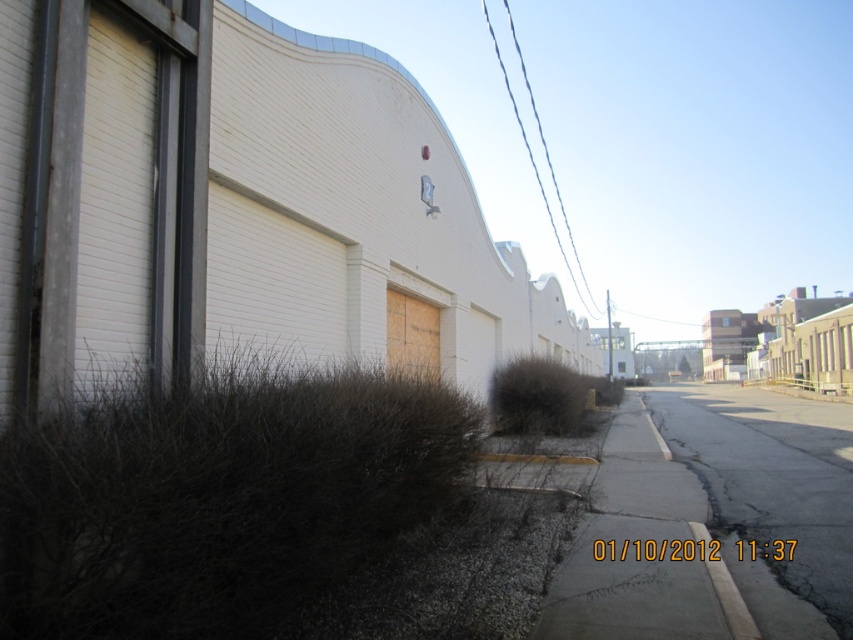
Between black asphalt road at center and gray concrete curb at lower right, which one appears on the left side from the viewer's perspective?

Positioned to the left is gray concrete curb at lower right.

Can you confirm if black asphalt road at center is positioned above gray concrete curb at lower right?

No.

Does point (737, 496) come behind point (715, 572)?

Yes, point (737, 496) is farther from viewer.

The height and width of the screenshot is (640, 853). I want to click on black asphalt road at center, so click(769, 486).

Can you confirm if gray asphalt pavement at center is positioned above gray concrete curb at lower right?

Incorrect, gray asphalt pavement at center is not positioned above gray concrete curb at lower right.

The width and height of the screenshot is (853, 640). What do you see at coordinates (641, 552) in the screenshot?
I see `gray asphalt pavement at center` at bounding box center [641, 552].

Is point (572, 593) farther from camera compared to point (724, 573)?

No, (572, 593) is closer to viewer.

Where is `gray asphalt pavement at center`? gray asphalt pavement at center is located at coordinates (641, 552).

Can you confirm if black asphalt road at center is bigger than wooden boarded garage door at center?

Correct, black asphalt road at center is larger in size than wooden boarded garage door at center.

Find the location of a particular element. The width and height of the screenshot is (853, 640). black asphalt road at center is located at coordinates (769, 486).